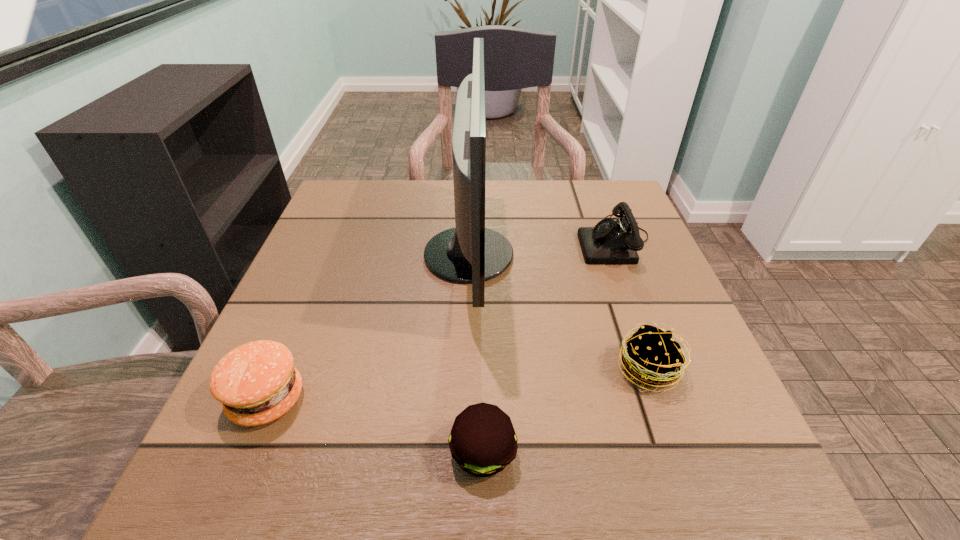
I want to click on vacant position in the image that satisfies the following two spatial constraints: 1. on the front side of the leftmost patty; 2. on the left side of the second patty from right to left, so click(245, 453).